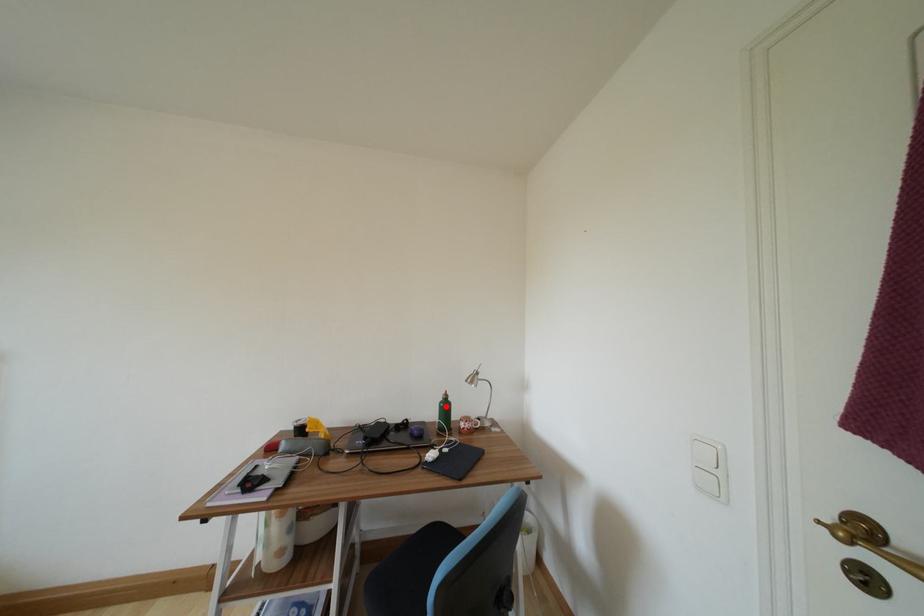
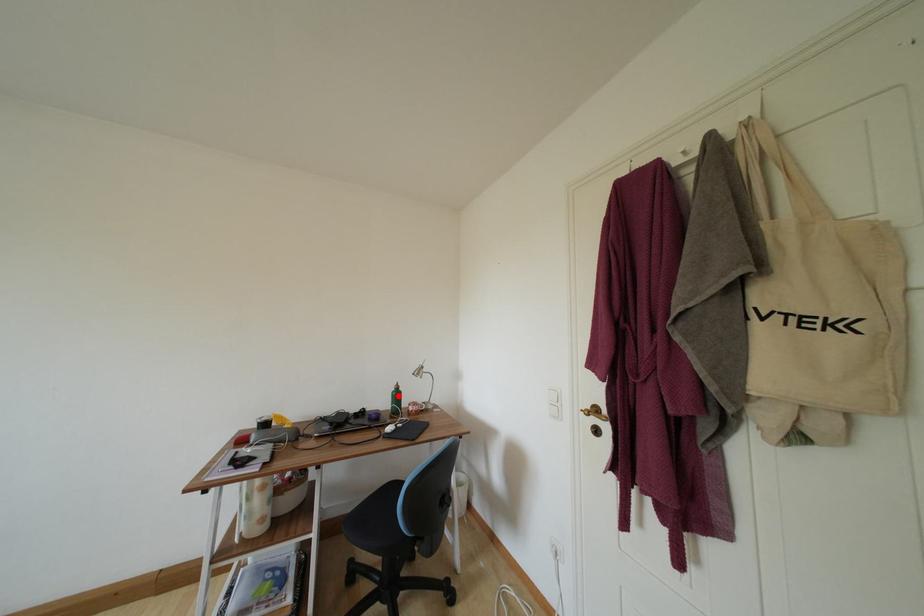
I am providing you with two images of the same scene from different viewpoints. A red point is marked on the first image and another point is marked on the second image. Is the red point in image1 aligned with the point shown in image2?

Yes